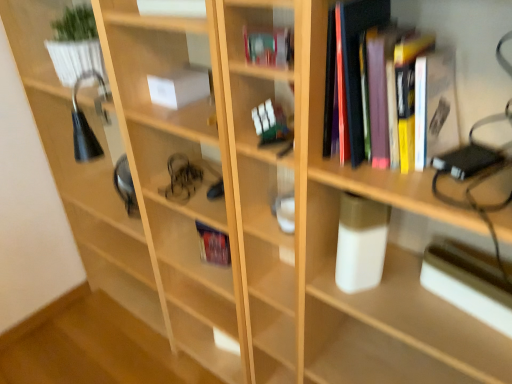
Question: Could you tell me if hardcover book at upper center, acting as the 4th book starting from the back, is turned towards hardcover books at upper right, which is the 5th book from back to front?

Choices:
 (A) yes
 (B) no

Answer: (B)

Question: Can you confirm if hardcover book at upper center, the 2th book positioned from the front, is thinner than hardcover books at upper right, which is the 5th book from back to front?

Choices:
 (A) no
 (B) yes

Answer: (B)

Question: Considering the relative sizes of hardcover book at upper center, acting as the 4th book starting from the back, and hardcover books at upper right, which is the 5th book from back to front, in the image provided, is hardcover book at upper center, acting as the 4th book starting from the back, taller than hardcover books at upper right, which is the 5th book from back to front,?

Choices:
 (A) no
 (B) yes

Answer: (A)

Question: From a real-world perspective, is hardcover book at upper center, acting as the 4th book starting from the back, on hardcover books at upper right, the first book viewed from the front?

Choices:
 (A) yes
 (B) no

Answer: (A)

Question: Is hardcover book at upper center, acting as the 4th book starting from the back, positioned before hardcover books at upper right, which is the 5th book from back to front?

Choices:
 (A) yes
 (B) no

Answer: (B)

Question: Would you consider hardcover book at upper center, acting as the 4th book starting from the back, to be distant from hardcover books at upper right, the first book viewed from the front?

Choices:
 (A) yes
 (B) no

Answer: (B)

Question: Is white paper at center, the 4th book when ordered from front to back, outside of metallic silver paperback book at right?

Choices:
 (A) no
 (B) yes

Answer: (B)

Question: Does white paper at center, the 4th book when ordered from front to back, have a greater width compared to metallic silver paperback book at right?

Choices:
 (A) no
 (B) yes

Answer: (B)

Question: Can you confirm if white paper at center, the 4th book when ordered from front to back, is bigger than metallic silver paperback book at right?

Choices:
 (A) no
 (B) yes

Answer: (A)

Question: Would you say white paper at center, the 4th book when ordered from front to back, contains metallic silver paperback book at right?

Choices:
 (A) no
 (B) yes

Answer: (A)

Question: Is white paper at center, the 4th book when ordered from front to back, oriented towards metallic silver paperback book at right?

Choices:
 (A) yes
 (B) no

Answer: (B)

Question: Is white paper at center, acting as the 2th book starting from the back, positioned behind metallic silver paperback book at right?

Choices:
 (A) no
 (B) yes

Answer: (B)

Question: Is white glossy glass at center, placed as the first shelf when sorted from right to left, oriented away from white glossy book at upper center, the third book from the front?

Choices:
 (A) no
 (B) yes

Answer: (A)